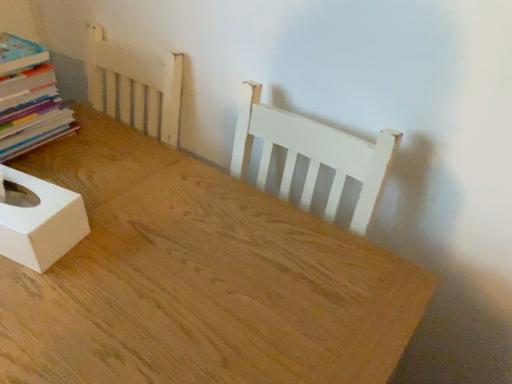
Question: Are white matte tissue box at lower left and natural wood table at center located far from each other?

Choices:
 (A) yes
 (B) no

Answer: (B)

Question: Is white matte tissue box at lower left beside natural wood table at center?

Choices:
 (A) yes
 (B) no

Answer: (B)

Question: From a real-world perspective, is white matte tissue box at lower left positioned over natural wood table at center based on gravity?

Choices:
 (A) yes
 (B) no

Answer: (A)

Question: From a real-world perspective, is white matte tissue box at lower left located beneath natural wood table at center?

Choices:
 (A) yes
 (B) no

Answer: (B)

Question: Considering the relative sizes of white matte tissue box at lower left and natural wood table at center in the image provided, is white matte tissue box at lower left thinner than natural wood table at center?

Choices:
 (A) yes
 (B) no

Answer: (A)

Question: From a real-world perspective, is multicolored paper stack at left physically located above or below natural wood table at center?

Choices:
 (A) below
 (B) above

Answer: (B)

Question: Considering the positions of multicolored paper stack at left and natural wood table at center in the image, is multicolored paper stack at left wider or thinner than natural wood table at center?

Choices:
 (A) thin
 (B) wide

Answer: (A)

Question: Considering the positions of multicolored paper stack at left and natural wood table at center in the image, is multicolored paper stack at left bigger or smaller than natural wood table at center?

Choices:
 (A) big
 (B) small

Answer: (B)

Question: Considering their positions, is multicolored paper stack at left located in front of or behind natural wood table at center?

Choices:
 (A) behind
 (B) front

Answer: (A)

Question: From a real-world perspective, is natural wood table at center above or below multicolored paper stack at left?

Choices:
 (A) above
 (B) below

Answer: (B)

Question: Is natural wood table at center taller or shorter than multicolored paper stack at left?

Choices:
 (A) short
 (B) tall

Answer: (B)

Question: Looking at the image, does natural wood table at center seem bigger or smaller compared to multicolored paper stack at left?

Choices:
 (A) small
 (B) big

Answer: (B)

Question: Is natural wood table at center spatially inside multicolored paper stack at left, or outside of it?

Choices:
 (A) outside
 (B) inside

Answer: (A)

Question: Is white matte tissue box at lower left in front of or behind natural wood table at center in the image?

Choices:
 (A) front
 (B) behind

Answer: (B)

Question: From the image's perspective, is white matte tissue box at lower left located above or below natural wood table at center?

Choices:
 (A) above
 (B) below

Answer: (A)